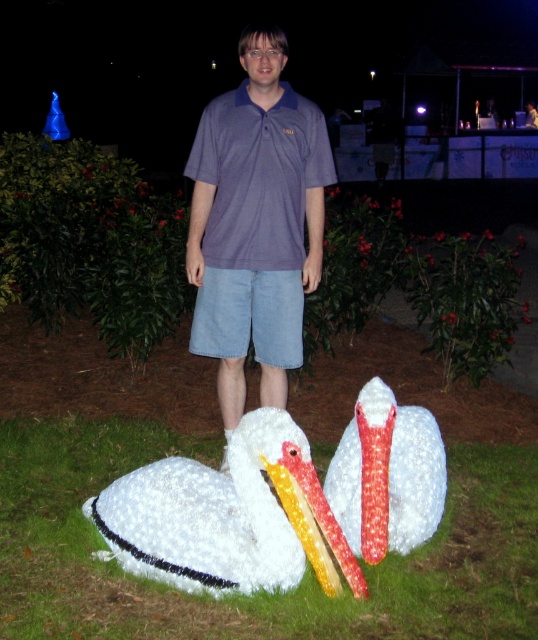
Question: Which object is closer to the camera taking this photo?

Choices:
 (A) white fluffy grass at lower center
 (B) white polystyrene swan at lower center

Answer: (A)

Question: Can you confirm if white fluffy grass at lower center is bigger than white polystyrene swan at lower center?

Choices:
 (A) yes
 (B) no

Answer: (A)

Question: Which object appears closest to the camera in this image?

Choices:
 (A) white fluffy grass at lower center
 (B) matte purple shirt at center
 (C) white fluffy swan at lower left
 (D) white polystyrene swan at lower center

Answer: (A)

Question: Is white fluffy grass at lower center further to the viewer compared to matte purple shirt at center?

Choices:
 (A) yes
 (B) no

Answer: (B)

Question: In this image, where is white fluffy grass at lower center located relative to matte purple shirt at center?

Choices:
 (A) above
 (B) below

Answer: (B)

Question: Which is farther from the matte purple shirt at center?

Choices:
 (A) white fluffy swan at lower left
 (B) white fluffy grass at lower center
 (C) white polystyrene swan at lower center

Answer: (B)